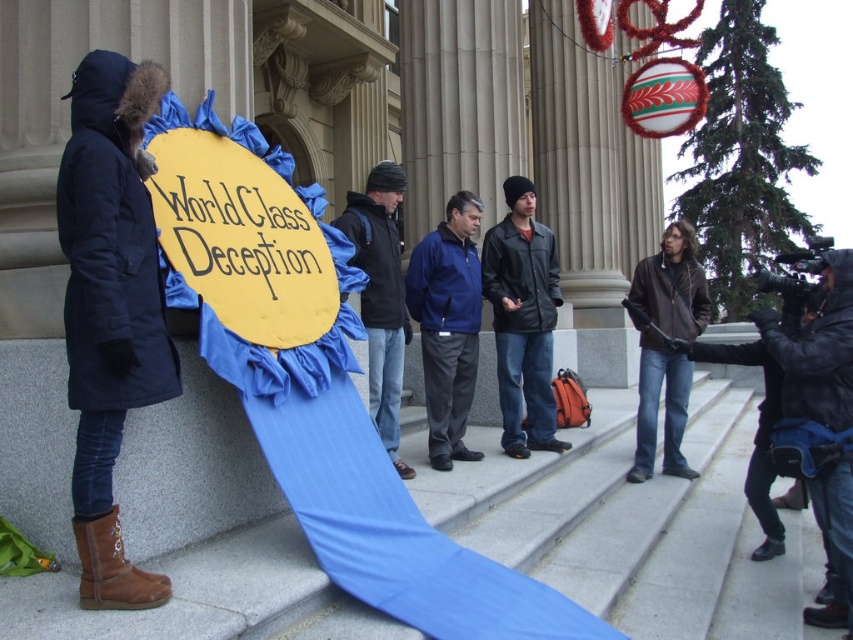
You are a photographer positioned at the front of the scene. You notice two points marked in the image. Which point, point (424, 257) or point (651, 428), is nearer to your current position?

Point (424, 257) is closer to the camera than point (651, 428), so the photographer would find point (424, 257) nearer to their current position.

You are a photographer trying to capture the blue fabric sign at center for a news article. The sign must be centered in the photo. Given that the sign is at coordinate point 0.508, 0.525, will you need to adjust your camera position to center it?

The blue fabric sign at center is already positioned at coordinate point (x=447, y=324), which is very close to the center of the image. Since the coordinates are nearly at the midpoint, minimal adjustment or no adjustment may be needed to center it.